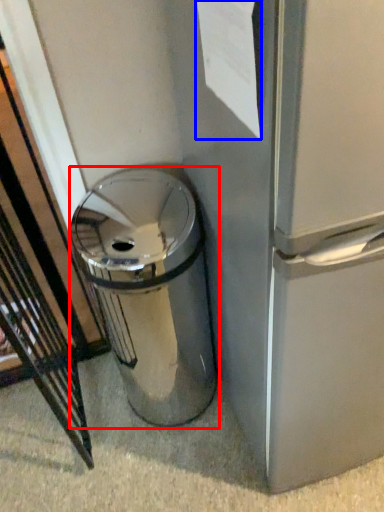
Question: Which point is further to the camera, waste container (highlighted by a red box) or paper (highlighted by a blue box)?

Choices:
 (A) waste container
 (B) paper

Answer: (A)